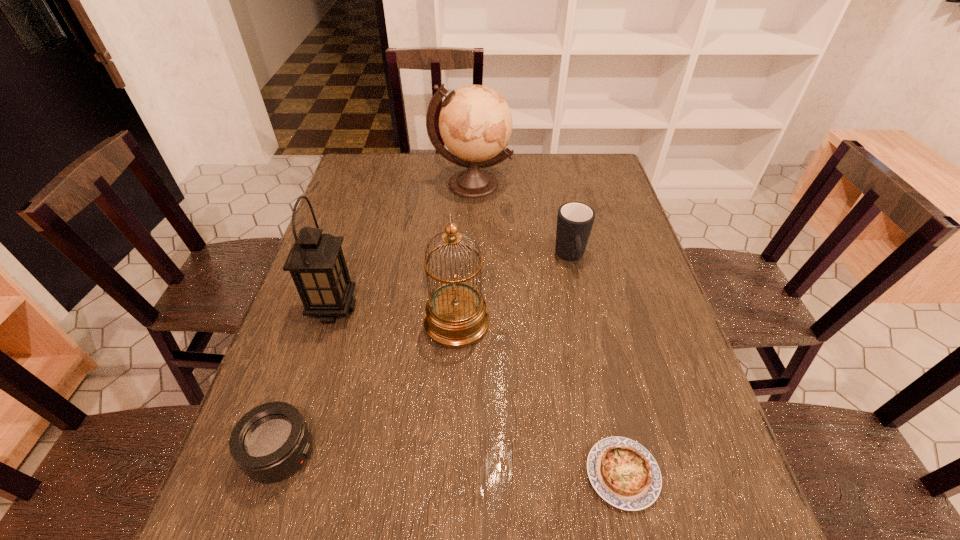
The width and height of the screenshot is (960, 540). In the image, there is a desktop. In order to click on vacant area at the right edge in this screenshot , I will do `click(653, 433)`.

Find the location of `blank space at the far left corner of the desktop`. blank space at the far left corner of the desktop is located at coordinates (353, 171).

At what (x,y) coordinates should I click in order to perform the action: click on free location at the far right corner of the desktop. Please return your answer as a coordinate pair (x, y). Image resolution: width=960 pixels, height=540 pixels. Looking at the image, I should click on (603, 171).

At what (x,y) coordinates should I click in order to perform the action: click on vacant area that lies between the lantern and the second shortest object. Please return your answer as a coordinate pair (x, y). Looking at the image, I should click on (307, 381).

Locate an element on the screen. This screenshot has width=960, height=540. vacant point located between the third shortest object and the globe is located at coordinates (521, 221).

Where is `free space between the quiche and the lantern`? Image resolution: width=960 pixels, height=540 pixels. free space between the quiche and the lantern is located at coordinates (478, 392).

Locate an element on the screen. This screenshot has width=960, height=540. free spot between the second shortest object and the mug is located at coordinates (426, 355).

This screenshot has width=960, height=540. I want to click on vacant space that's between the fourth tallest object and the globe, so click(x=521, y=221).

At what (x,y) coordinates should I click in order to perform the action: click on free space between the fifth tallest object and the fourth tallest object. Please return your answer as a coordinate pair (x, y). Looking at the image, I should click on [x=426, y=355].

Identify the location of free space that is in between the second shortest object and the third shortest object. This screenshot has width=960, height=540. (426, 355).